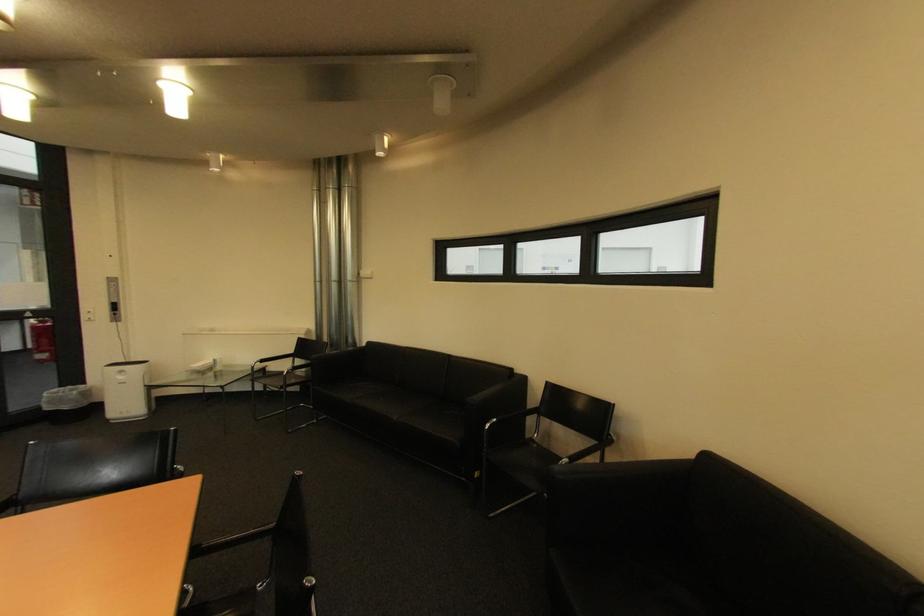
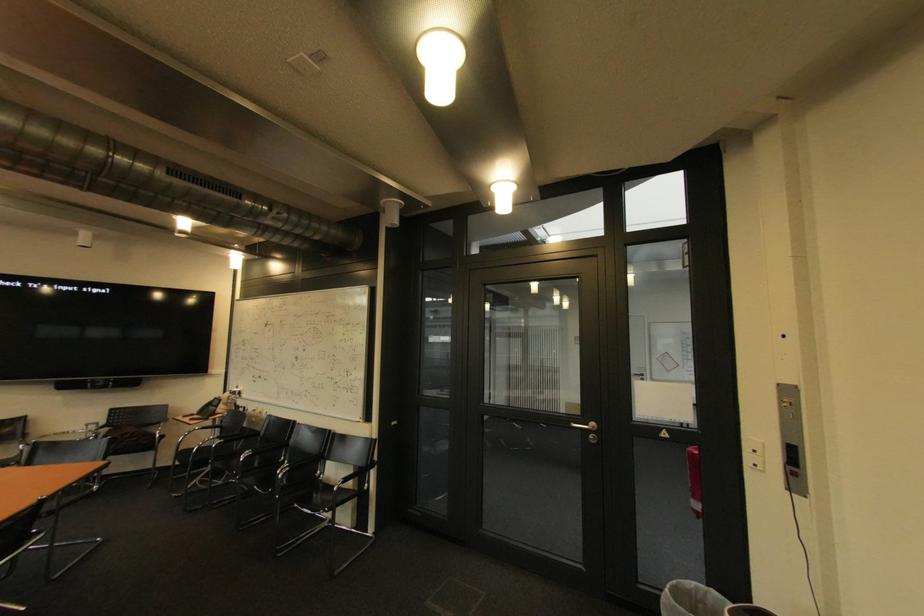
Where in the second image is the point corresponding to (42,359) from the first image?

(698, 501)